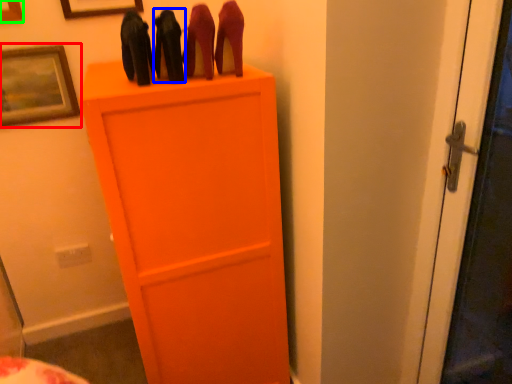
Question: Which is farther away from picture frame (highlighted by a red box)? stuff (highlighted by a blue box) or picture frame (highlighted by a green box)?

Choices:
 (A) stuff
 (B) picture frame

Answer: (A)